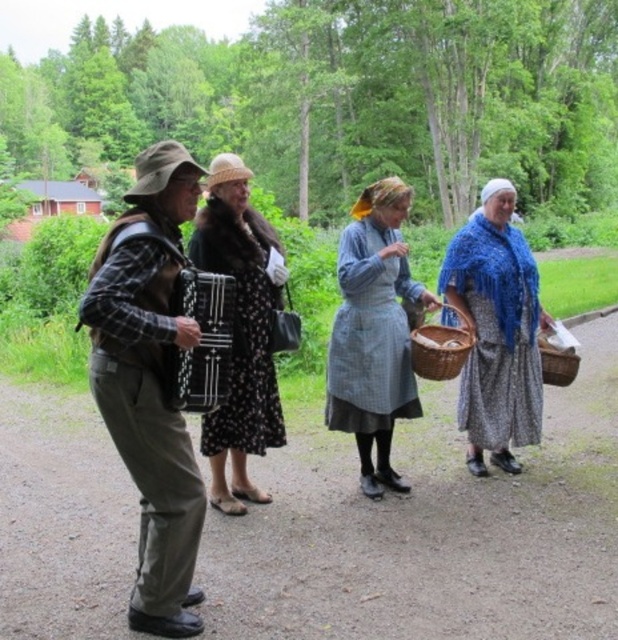
What do you see at coordinates (428, 532) in the screenshot?
I see `brown dirt path at center` at bounding box center [428, 532].

Is brown dirt path at center above black dotted dress at center?

No, brown dirt path at center is not above black dotted dress at center.

Who is more distant from viewer, [11,573] or [263,282]?

The point [263,282] is more distant.

Where is `brown dirt path at center`? This screenshot has width=618, height=640. brown dirt path at center is located at coordinates (428, 532).

Measure the distance between brown dirt path at center and woven brown basket at center.

They are 3.71 feet apart.

Which is behind, point (91, 509) or point (433, 332)?

The point (433, 332) is behind.

Measure the distance between brown dirt path at center and camera.

brown dirt path at center is 3.91 meters away from camera.

This screenshot has height=640, width=618. I want to click on brown dirt path at center, so click(428, 532).

From the picture: Does blue knitted shawl at right have a greater width compared to brown woven basket at center?

Yes.

Where is `blue knitted shawl at right`? blue knitted shawl at right is located at coordinates (496, 330).

Who is more forward, [549,323] or [439,337]?

Point [439,337]

Locate an element on the screen. The height and width of the screenshot is (640, 618). blue knitted shawl at right is located at coordinates (496, 330).